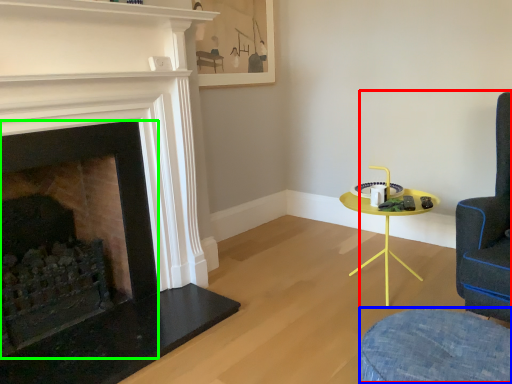
Question: Which object is positioned closest to swivel chair (highlighted by a red box)? Select from swivel chair (highlighted by a blue box) and fireplace (highlighted by a green box).

Choices:
 (A) swivel chair
 (B) fireplace

Answer: (A)